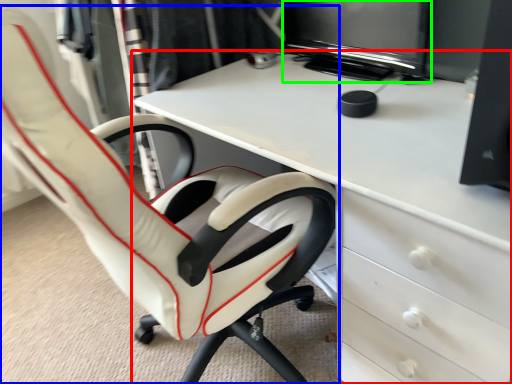
Question: Which is farther away from desk (highlighted by a red box)? chair (highlighted by a blue box) or computer monitor (highlighted by a green box)?

Choices:
 (A) chair
 (B) computer monitor

Answer: (B)